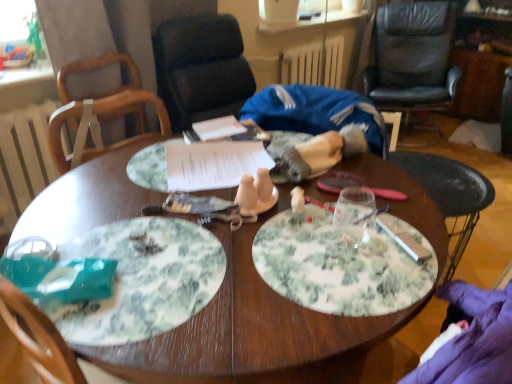
Question: Is white crumbly food at center looking in the opposite direction of green floral plate at center, the first plate positioned from the front?

Choices:
 (A) no
 (B) yes

Answer: (A)

Question: Considering the relative sizes of white crumbly food at center and green floral plate at center, which appears as the second plate when viewed from the back, in the image provided, is white crumbly food at center taller than green floral plate at center, which appears as the second plate when viewed from the back,?

Choices:
 (A) no
 (B) yes

Answer: (B)

Question: From a real-world perspective, is white crumbly food at center under green floral plate at center, which appears as the second plate when viewed from the back?

Choices:
 (A) no
 (B) yes

Answer: (A)

Question: Is white crumbly food at center next to green floral plate at center, which ranks as the 2th plate in top-to-bottom order?

Choices:
 (A) yes
 (B) no

Answer: (B)

Question: Is white crumbly food at center behind green floral plate at center, which appears as the second plate when viewed from the back?

Choices:
 (A) yes
 (B) no

Answer: (A)

Question: Considering the positions of green floral plate at center, which is the first plate in bottom-to-top order, and white painted metal radiator at upper center, the first radiator positioned from the top, in the image, is green floral plate at center, which is the first plate in bottom-to-top order, bigger or smaller than white painted metal radiator at upper center, the first radiator positioned from the top,?

Choices:
 (A) small
 (B) big

Answer: (A)

Question: Looking at their shapes, would you say green floral plate at center, which ranks as the 2th plate in top-to-bottom order, is wider or thinner than white painted metal radiator at upper center, positioned as the first radiator in right-to-left order?

Choices:
 (A) thin
 (B) wide

Answer: (B)

Question: From a real-world perspective, is green floral plate at center, which ranks as the 2th plate in top-to-bottom order, above or below white painted metal radiator at upper center, positioned as the first radiator in right-to-left order?

Choices:
 (A) above
 (B) below

Answer: (A)

Question: Relative to white painted metal radiator at upper center, positioned as the first radiator in right-to-left order, is green floral plate at center, which ranks as the 2th plate in top-to-bottom order, in front or behind?

Choices:
 (A) behind
 (B) front

Answer: (B)

Question: Considering the positions of white crumbly food at center and white painted wood radiator at left, the 2th radiator from the right, in the image, is white crumbly food at center taller or shorter than white painted wood radiator at left, the 2th radiator from the right,?

Choices:
 (A) short
 (B) tall

Answer: (A)

Question: Is white crumbly food at center bigger or smaller than white painted wood radiator at left, the 2th radiator from the right?

Choices:
 (A) small
 (B) big

Answer: (A)

Question: Is white crumbly food at center wider or thinner than white painted wood radiator at left, the 2th radiator from the right?

Choices:
 (A) wide
 (B) thin

Answer: (B)

Question: Is white crumbly food at center in front of or behind white painted wood radiator at left, the first radiator from the bottom, in the image?

Choices:
 (A) behind
 (B) front

Answer: (B)

Question: Is green floral plate at center, which is the first plate in bottom-to-top order, inside the boundaries of wooden chair at upper left, arranged as the 2th chair when viewed from the right, or outside?

Choices:
 (A) inside
 (B) outside

Answer: (B)

Question: Looking at their shapes, would you say green floral plate at center, which ranks as the 2th plate in top-to-bottom order, is wider or thinner than wooden chair at upper left, arranged as the second chair when viewed from the back?

Choices:
 (A) thin
 (B) wide

Answer: (A)